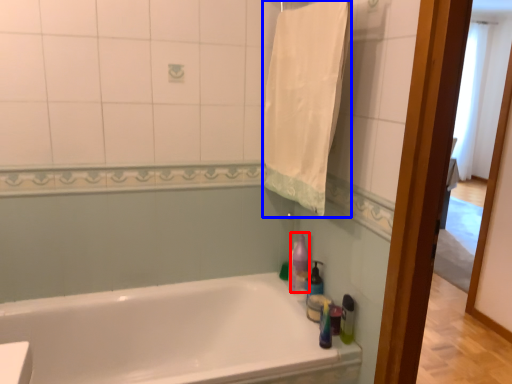
Question: Which of the following is the farthest to the observer, cleaning product (highlighted by a red box) or bath towel (highlighted by a blue box)?

Choices:
 (A) cleaning product
 (B) bath towel

Answer: (A)